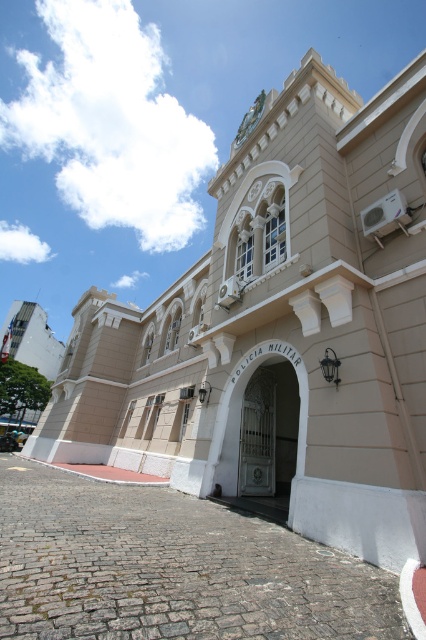
You are a visitor approaching the entrance of the historic building. You see the white metal gate at center and the gold metallic clock at upper center. Which object appears taller from your perspective?

The gold metallic clock at upper center appears taller than the white metal gate at center because it has a greater height.

You are standing in front of the historic building and notice two points marked on the facade. One is at coordinates point (207, 465) and the other at point (241, 134). Which point is closer to you?

Point (207, 465) is in front of point (241, 134), so it is closer to you.